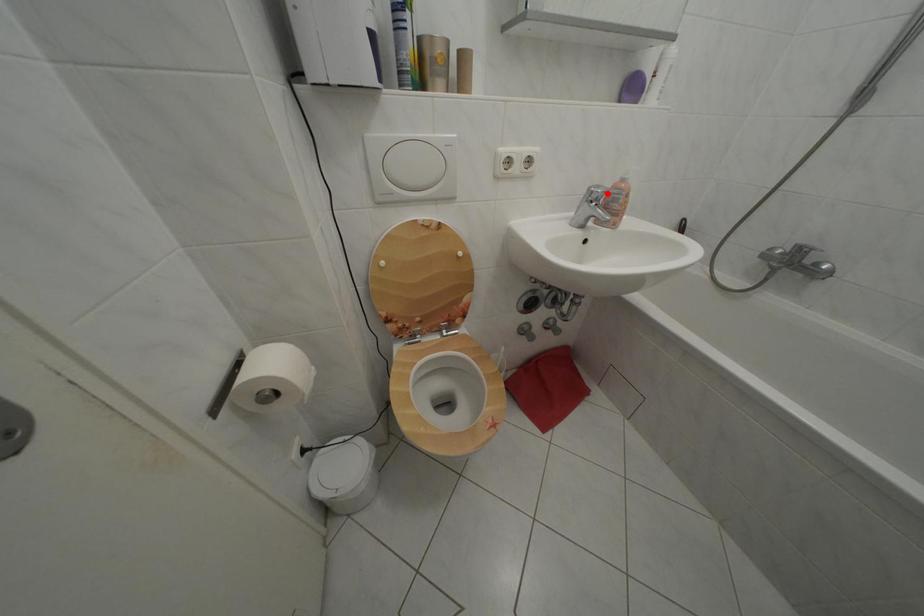
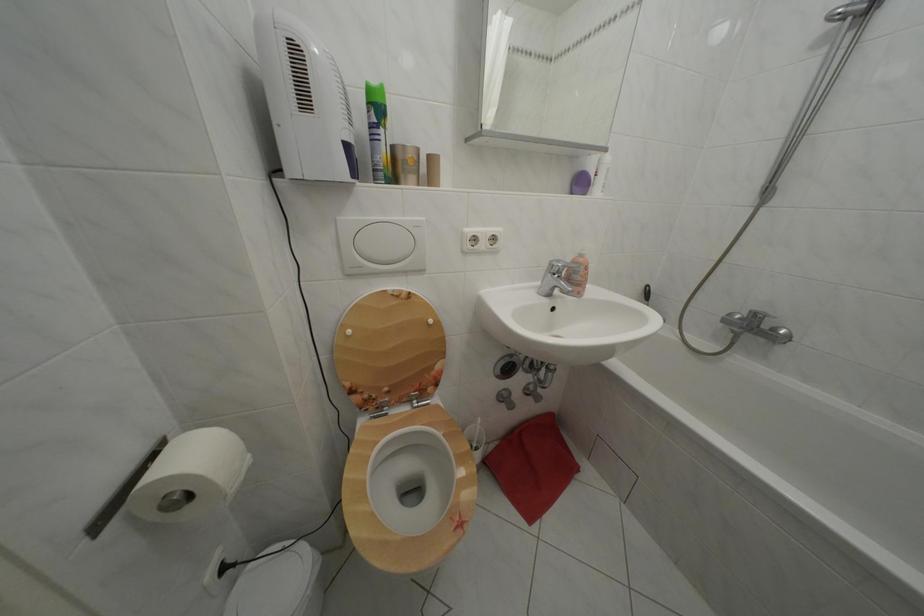
Locate, in the second image, the point that corresponds to the highlighted location in the first image.

(567, 268)